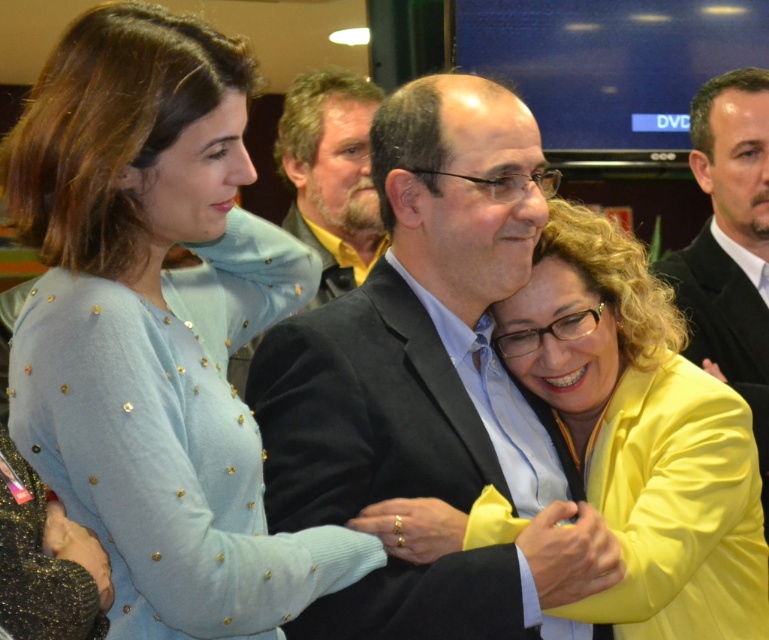
Question: Is matte black suit at center to the right of black suit at right from the viewer's perspective?

Choices:
 (A) yes
 (B) no

Answer: (B)

Question: Which point is closer to the camera?

Choices:
 (A) matte black suit at center
 (B) yellow matte jacket at center

Answer: (A)

Question: Does light blue knit sweater at upper left appear on the left side of bearded man at center?

Choices:
 (A) yes
 (B) no

Answer: (A)

Question: Which object is the closest to the light blue knit sweater at upper left?

Choices:
 (A) black suit at right
 (B) yellow matte jacket at center

Answer: (B)

Question: Estimate the real-world distances between objects in this image. Which object is farther from the yellow matte jacket at center?

Choices:
 (A) black suit at right
 (B) light blue knit sweater at upper left
 (C) bearded man at center
 (D) matte black suit at center

Answer: (C)

Question: Is matte black suit at center to the left of bearded man at center from the viewer's perspective?

Choices:
 (A) yes
 (B) no

Answer: (B)